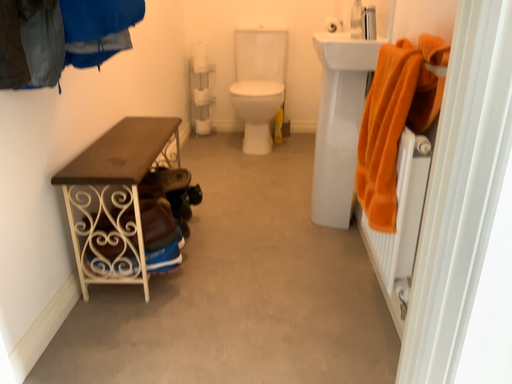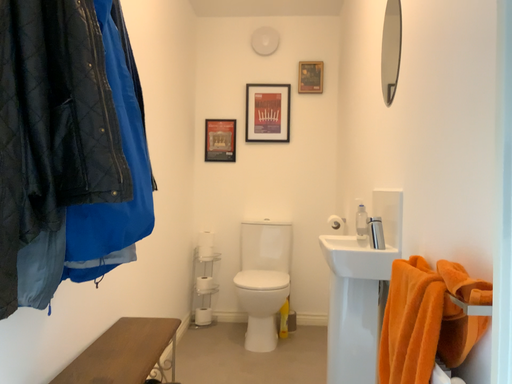
Question: How did the camera likely rotate when shooting the video?

Choices:
 (A) rotated upward
 (B) rotated downward

Answer: (A)